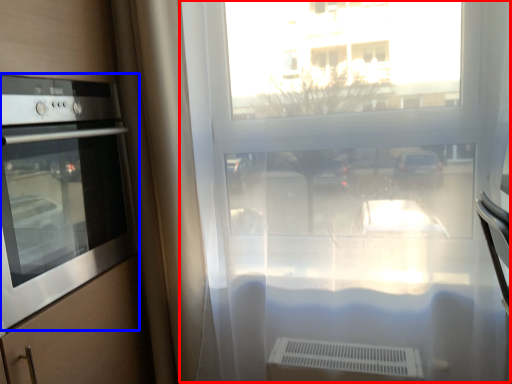
Question: Among these objects, which one is farthest to the camera, window frame (highlighted by a red box) or home appliance (highlighted by a blue box)?

Choices:
 (A) window frame
 (B) home appliance

Answer: (A)